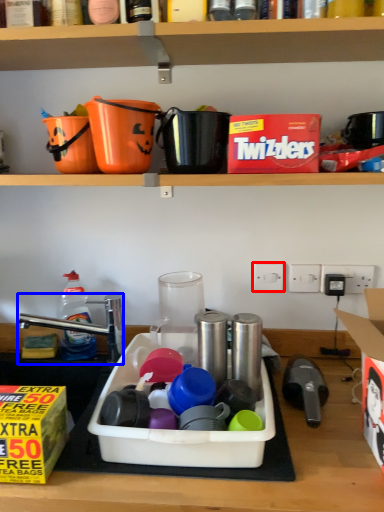
Question: Which object is closer to the camera taking this photo, electric outlet (highlighted by a red box) or faucet (highlighted by a blue box)?

Choices:
 (A) electric outlet
 (B) faucet

Answer: (B)